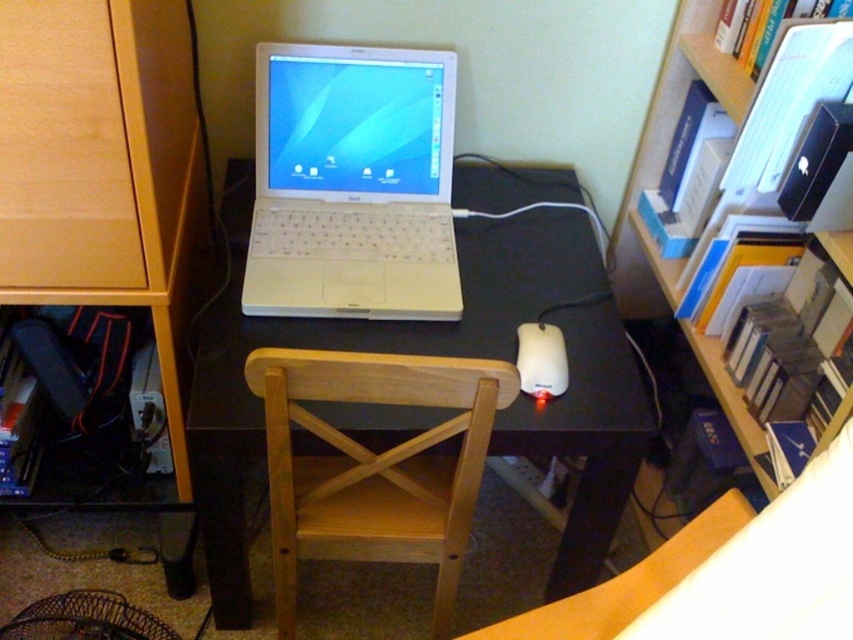
You are organizing a space for a guest to work. You need to ensure the guest can comfortably sit and use the computer. Given the light wood chair at center and the white plastic mouse at center, which object should you adjust first to accommodate the guest?

The light wood chair at center is larger in size than the white plastic mouse at center, so you should adjust the chair first to ensure proper seating for the guest.

You are organizing a small meeting in the home office and need to move a 16 inch wide presentation board between the light wood chair at center and the matte wood drawer at left. Will the board fit through the space between them?

The light wood chair at center and the matte wood drawer at left are 16.34 inches apart, so the 16 inch wide presentation board will fit through the space between them since it is narrower than the available gap.

You are standing in front of the desk and want to move an object from point (x=308, y=67) to point (x=120, y=170). Which direction should you move it?

You should move the object from point (x=308, y=67) towards the back of the desk because point (x=120, y=170) is closer to the desk than point (x=308, y=67).